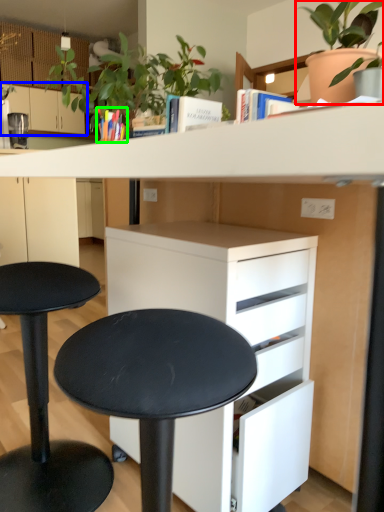
Question: Considering the real-world distances, which object is closest to houseplant (highlighted by a red box)? cabinetry (highlighted by a blue box) or book (highlighted by a green box).

Choices:
 (A) cabinetry
 (B) book

Answer: (B)